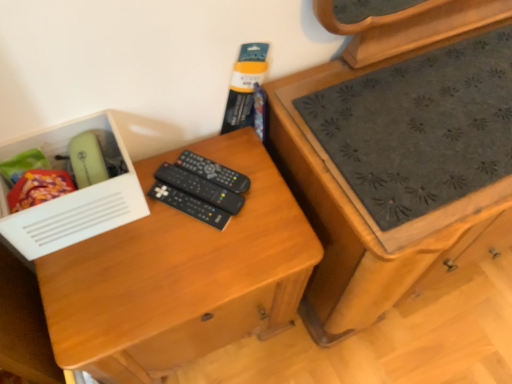
Where is `free spot to the right of black plastic remote controls at center, which is counted as the 1th remote control, starting from the top`? This screenshot has width=512, height=384. free spot to the right of black plastic remote controls at center, which is counted as the 1th remote control, starting from the top is located at coordinates (267, 191).